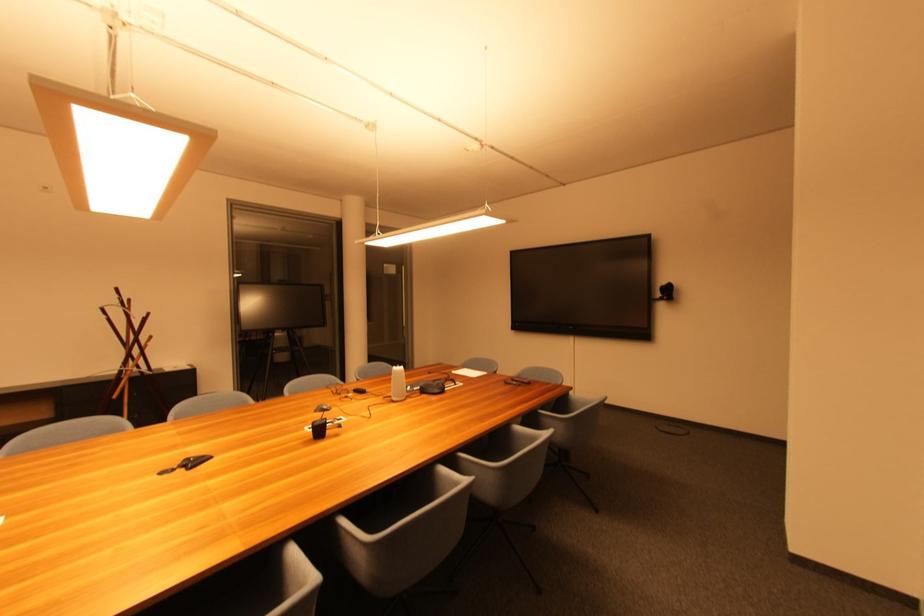
Where would you lift the black pen holder? Please return your answer as a coordinate pair (x, y).

(319, 428)